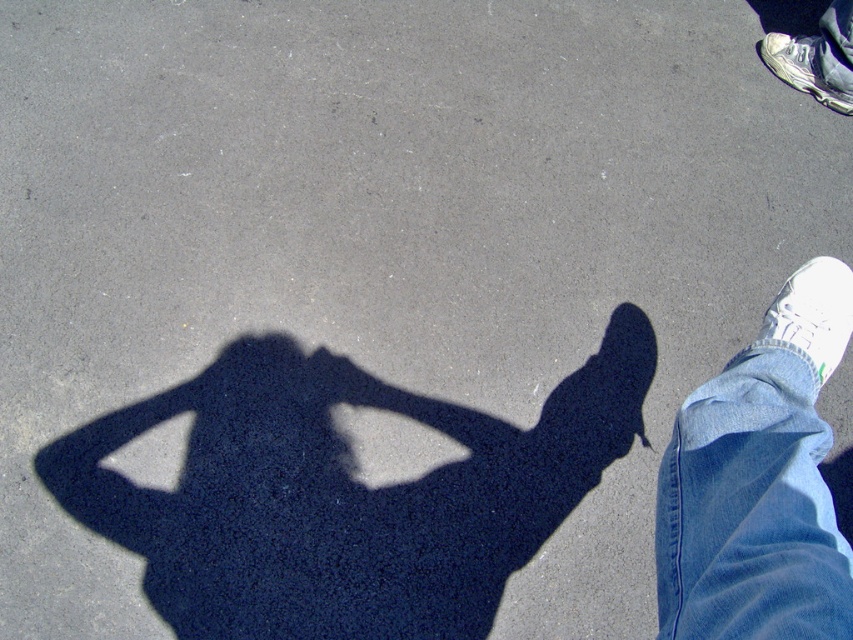
Does blue denim jeans at lower right appear under white leather shoe at upper right?

Yes.

Between blue denim jeans at lower right and white leather shoe at upper right, which one has less height?

white leather shoe at upper right is shorter.

Who is more distant from viewer, (848, 566) or (788, 42)?

Point (788, 42)

I want to click on blue denim jeans at lower right, so click(750, 509).

From the picture: Does blue denim jeans at lower right have a greater width compared to white leather shoe at lower right?

Yes.

Consider the image. Who is shorter, blue denim jeans at lower right or white leather shoe at lower right?

With less height is white leather shoe at lower right.

Which is behind, point (726, 570) or point (808, 314)?

The point (808, 314) is more distant.

Find the location of a particular element. The image size is (853, 640). blue denim jeans at lower right is located at coordinates (750, 509).

Does white leather shoe at lower right have a greater height compared to white leather shoe at upper right?

No, white leather shoe at lower right is not taller than white leather shoe at upper right.

Is point (813, 358) closer to camera compared to point (836, 99)?

Yes, it is in front of point (836, 99).

The height and width of the screenshot is (640, 853). In order to click on white leather shoe at lower right in this screenshot , I will do `click(811, 314)`.